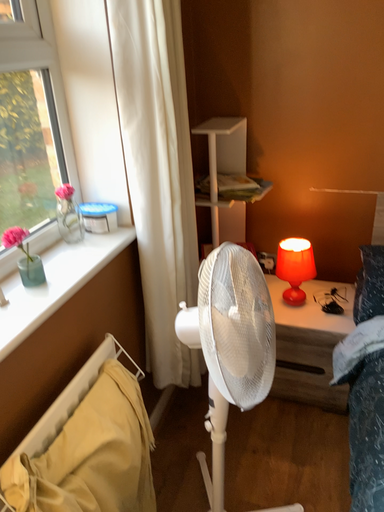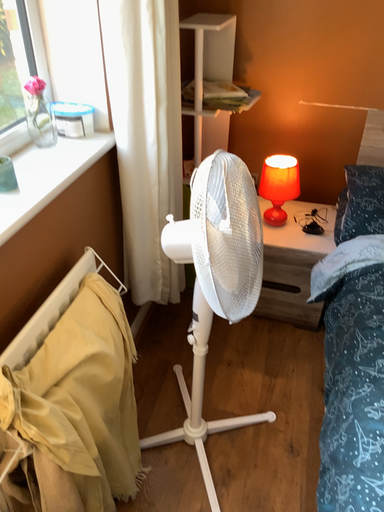
Question: How did the camera likely rotate when shooting the video?

Choices:
 (A) rotated upward
 (B) rotated downward

Answer: (B)